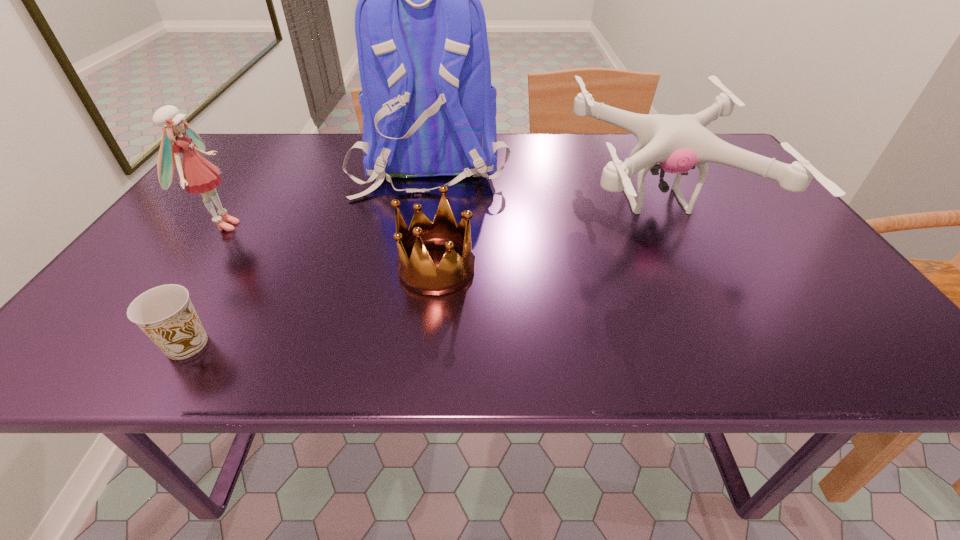
Find the location of a particular element. The image size is (960, 540). vacant space positioned on the top of the third shortest object is located at coordinates (480, 201).

Where is `free spot located on the top of the third shortest object`? free spot located on the top of the third shortest object is located at coordinates (452, 201).

Identify the location of vacant area located on the left of the fourth tallest object. (350, 267).

The height and width of the screenshot is (540, 960). I want to click on free space located 0.220m on the back of the shortest object, so click(x=245, y=249).

The image size is (960, 540). What are the coordinates of `backpack present at the far edge` in the screenshot? It's located at (428, 107).

The image size is (960, 540). Identify the location of drone present at the far edge. (677, 142).

This screenshot has height=540, width=960. In order to click on object located at the near edge in this screenshot , I will do `click(165, 314)`.

Find the location of a particular element. The width and height of the screenshot is (960, 540). object that is at the left edge is located at coordinates (197, 175).

Locate an element on the screen. The image size is (960, 540). object that is positioned at the right edge is located at coordinates (677, 142).

Where is `object present at the far right corner`? This screenshot has width=960, height=540. object present at the far right corner is located at coordinates (677, 142).